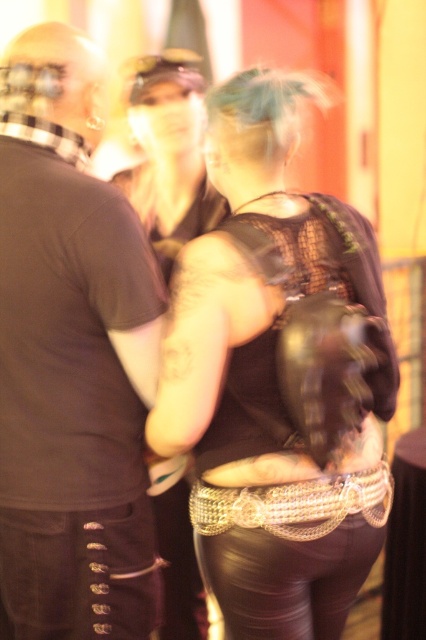
Who is higher up, leather pants at center or leather-like dark brown belt at lower left?

leather pants at center

Who is lower down, leather pants at center or leather-like dark brown belt at lower left?

Positioned lower is leather-like dark brown belt at lower left.

Does point (161, 547) come farther from viewer compared to point (46, 536)?

That is True.

The height and width of the screenshot is (640, 426). Identify the location of leather pants at center. (169, 154).

Who is taller, matte black shirt at left or leather pants at center?

matte black shirt at left

Who is more distant from viewer, (132, 220) or (221, 198)?

The point (221, 198) is more distant.

Is point (22, 342) in front of point (186, 196)?

Yes.

This screenshot has height=640, width=426. In order to click on matte black shirt at left in this screenshot , I will do `click(71, 358)`.

Between matte black shirt at left and leather-like dark brown belt at lower left, which one has less height?

With less height is leather-like dark brown belt at lower left.

Between matte black shirt at left and leather-like dark brown belt at lower left, which one is positioned lower?

leather-like dark brown belt at lower left

What are the coordinates of `matte black shirt at left` in the screenshot? It's located at (71, 358).